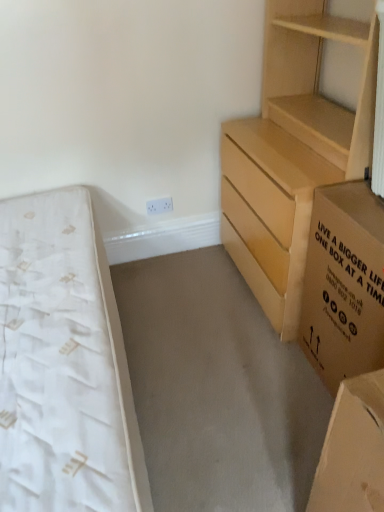
Question: Is light brown wooden chest of drawers at right touching white textured mattress at left?

Choices:
 (A) no
 (B) yes

Answer: (A)

Question: Is white textured mattress at left inside light brown wooden chest of drawers at right?

Choices:
 (A) yes
 (B) no

Answer: (B)

Question: From the image's perspective, does light brown wooden chest of drawers at right appear higher than white textured mattress at left?

Choices:
 (A) no
 (B) yes

Answer: (B)

Question: Does light brown wooden chest of drawers at right lie behind white textured mattress at left?

Choices:
 (A) no
 (B) yes

Answer: (B)

Question: Considering the relative positions of light brown wooden chest of drawers at right and white textured mattress at left in the image provided, is light brown wooden chest of drawers at right in front of white textured mattress at left?

Choices:
 (A) yes
 (B) no

Answer: (B)

Question: Based on their positions, is light brown wooden chest of drawers at right located to the left or right of brown cardboard box at right?

Choices:
 (A) left
 (B) right

Answer: (A)

Question: Is light brown wooden chest of drawers at right inside the boundaries of brown cardboard box at right, or outside?

Choices:
 (A) outside
 (B) inside

Answer: (A)

Question: Is point tap(294, 24) closer or farther from the camera than point tap(322, 227)?

Choices:
 (A) farther
 (B) closer

Answer: (A)

Question: In terms of height, does light brown wooden chest of drawers at right look taller or shorter compared to brown cardboard box at right?

Choices:
 (A) short
 (B) tall

Answer: (B)

Question: Does point (286, 320) appear closer or farther from the camera than point (13, 345)?

Choices:
 (A) closer
 (B) farther

Answer: (B)

Question: From the image's perspective, is light brown wooden chest of drawers at right above or below white textured mattress at left?

Choices:
 (A) below
 (B) above

Answer: (B)

Question: From a real-world perspective, is light brown wooden chest of drawers at right above or below white textured mattress at left?

Choices:
 (A) above
 (B) below

Answer: (A)

Question: Based on their positions, is light brown wooden chest of drawers at right located to the left or right of white textured mattress at left?

Choices:
 (A) right
 (B) left

Answer: (A)

Question: Is white textured mattress at left spatially inside light brown wooden chest of drawers at right, or outside of it?

Choices:
 (A) outside
 (B) inside

Answer: (A)

Question: From a real-world perspective, is white textured mattress at left physically located above or below light brown wooden chest of drawers at right?

Choices:
 (A) below
 (B) above

Answer: (A)